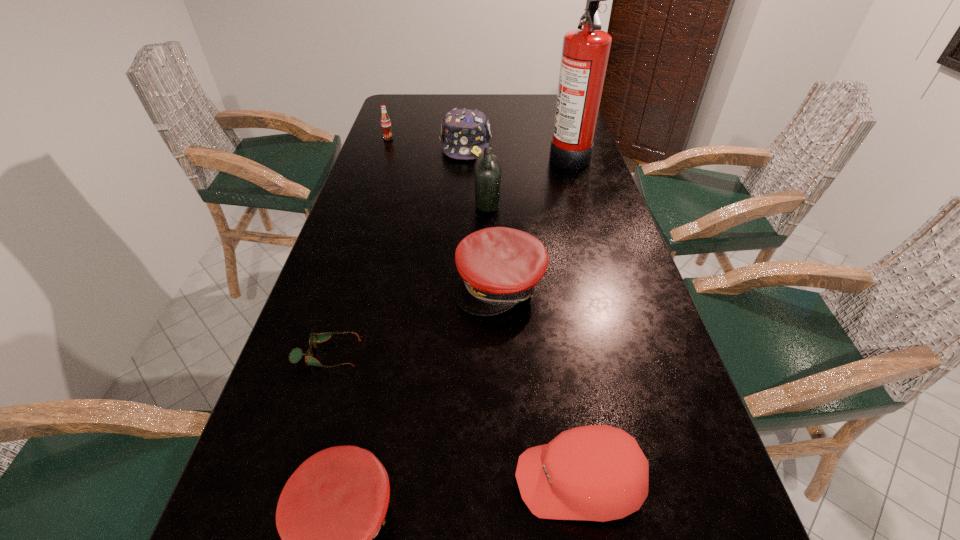
Find the location of `vacant space situated on the front-facing side of the tallest object`. vacant space situated on the front-facing side of the tallest object is located at coordinates (438, 156).

I want to click on vacant space situated 0.280m on the right of the seventh shortest object, so click(598, 204).

This screenshot has width=960, height=540. I want to click on vacant space located on the right of the soda, so click(x=407, y=138).

Find the location of a particular element. vacant space located on the front-facing side of the farthest cap is located at coordinates (463, 212).

Locate an element on the screen. The width and height of the screenshot is (960, 540). vacant area situated 0.400m on the front-facing side of the fifth farthest object is located at coordinates (511, 521).

Find the location of a particular element. The width and height of the screenshot is (960, 540). blank area located on the front-facing side of the shortest object is located at coordinates (480, 354).

I want to click on soda that is at the left edge, so click(x=385, y=121).

At what (x,y) coordinates should I click in order to perform the action: click on spectacles positioned at the left edge. Please return your answer as a coordinate pair (x, y). The image size is (960, 540). Looking at the image, I should click on (295, 356).

This screenshot has height=540, width=960. I want to click on fire extinguisher that is at the right edge, so click(x=585, y=52).

You are a GUI agent. You are given a task and a screenshot of the screen. Output one action in this format:
    pyautogui.click(x=<x>, y=<y>)
    Task: Click on the cap located at the right edge
    
    Given the screenshot: What is the action you would take?
    pyautogui.click(x=599, y=473)